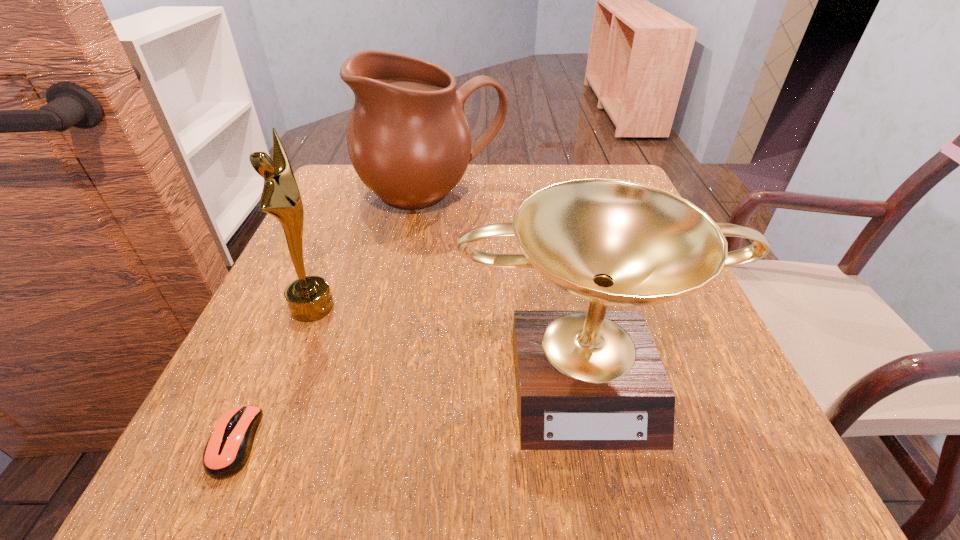
This screenshot has height=540, width=960. I want to click on free spot at the left edge of the desktop, so click(x=324, y=229).

I want to click on vacant space at the right edge, so click(663, 364).

The image size is (960, 540). In the image, there is a desktop. In order to click on free region at the far left corner in this screenshot , I will do `click(348, 171)`.

Image resolution: width=960 pixels, height=540 pixels. Find the location of `vacant area at the far right corner`. vacant area at the far right corner is located at coordinates (569, 175).

Where is `blank region between the cream pitcher and the left award`? The image size is (960, 540). blank region between the cream pitcher and the left award is located at coordinates (372, 251).

Locate an element on the screen. The image size is (960, 540). unoccupied area between the farthest object and the computer mouse is located at coordinates (333, 319).

The image size is (960, 540). I want to click on free space between the left award and the cream pitcher, so click(372, 251).

This screenshot has height=540, width=960. What are the coordinates of `unoccupied position between the left award and the computer mouse` in the screenshot? It's located at (274, 375).

This screenshot has width=960, height=540. I want to click on vacant space that's between the left award and the right award, so click(448, 340).

Locate an element on the screen. This screenshot has width=960, height=540. free spot between the farthest object and the left award is located at coordinates (372, 251).